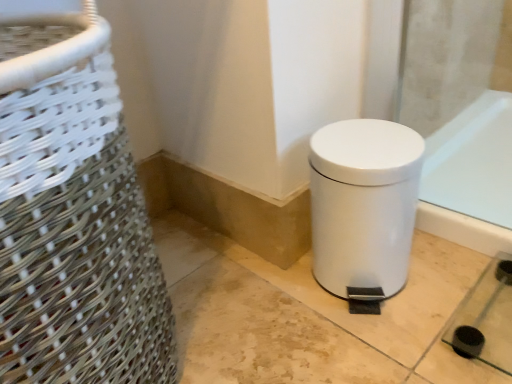
At what (x,y) coordinates should I click in order to perform the action: click on blank space situated above white matte waste container at lower right (from a real-world perspective). Please return your answer as a coordinate pair (x, y). Looking at the image, I should click on (369, 144).